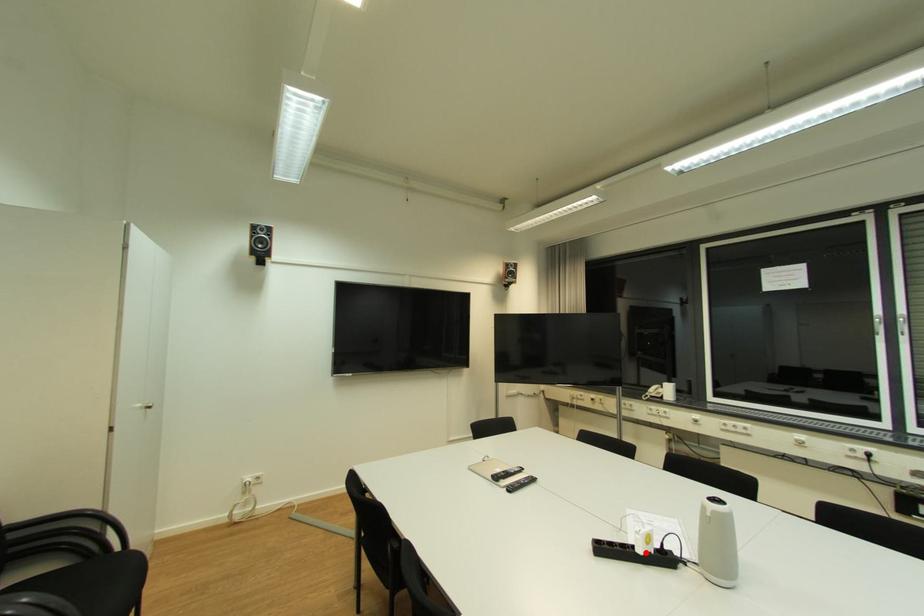
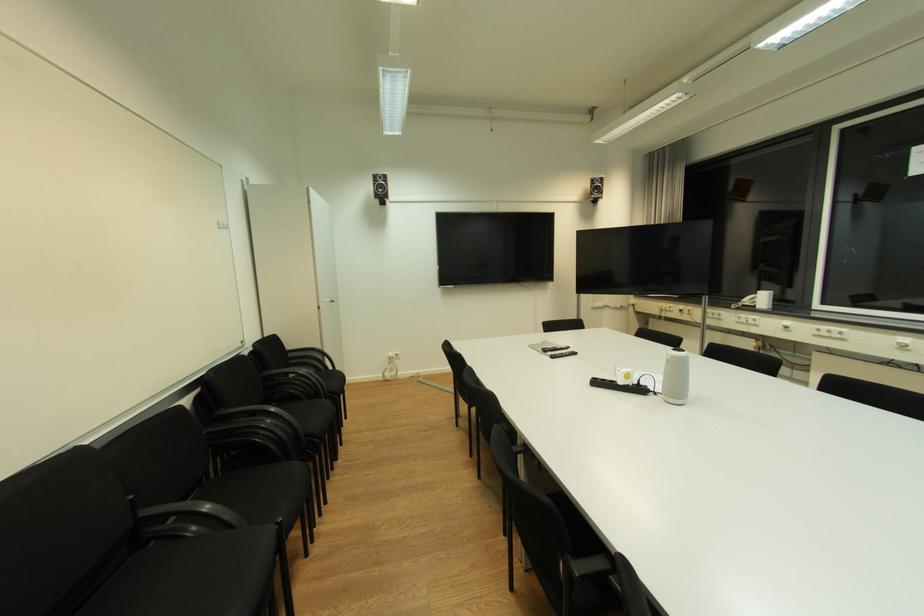
Find the pixel in the second image that matches the highlighted location in the first image.

(626, 384)